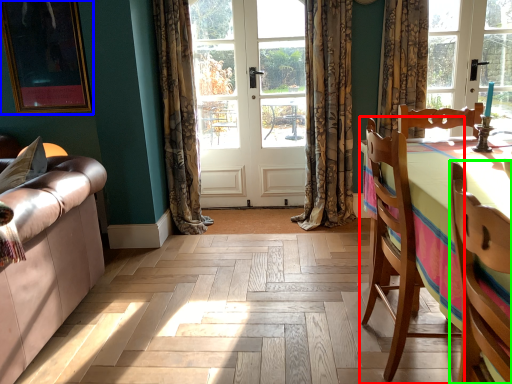
Question: Based on their relative distances, which object is farther from chair (highlighted by a red box)? Choose from picture frame (highlighted by a blue box) and chair (highlighted by a green box).

Choices:
 (A) picture frame
 (B) chair

Answer: (A)